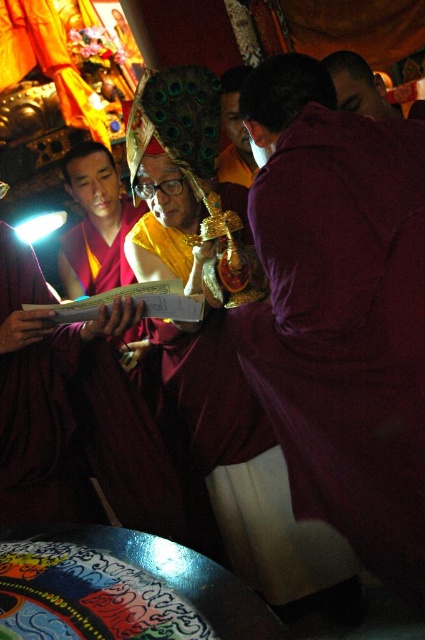
Between point (357, 116) and point (374, 116), which one is positioned in front?

Positioned in front is point (357, 116).

Consider the image. Who is positioned more to the left, purple velvet robe at center or maroon robe at upper right?

purple velvet robe at center is more to the left.

Identify the location of purple velvet robe at center. This screenshot has width=425, height=640. [340, 310].

Find the location of a particular element. purple velvet robe at center is located at coordinates (340, 310).

Does purple velvet robe at center have a smaller size compared to matte gold mask at center?

No.

In the scene shown: Who is shorter, purple velvet robe at center or matte gold mask at center?

Standing shorter between the two is matte gold mask at center.

Does point (303, 289) lie behind point (243, 150)?

No, (303, 289) is in front of (243, 150).

The height and width of the screenshot is (640, 425). I want to click on purple velvet robe at center, so click(x=340, y=310).

Does maroon robe at upper right have a lesser width compared to matte gold mask at center?

No.

Measure the distance between maroon robe at upper right and matte gold mask at center.

The distance of maroon robe at upper right from matte gold mask at center is 2.06 meters.

Does point (337, 68) come closer to viewer compared to point (232, 124)?

Yes, it is.

Locate an element on the screen. This screenshot has height=640, width=425. maroon robe at upper right is located at coordinates (357, 84).